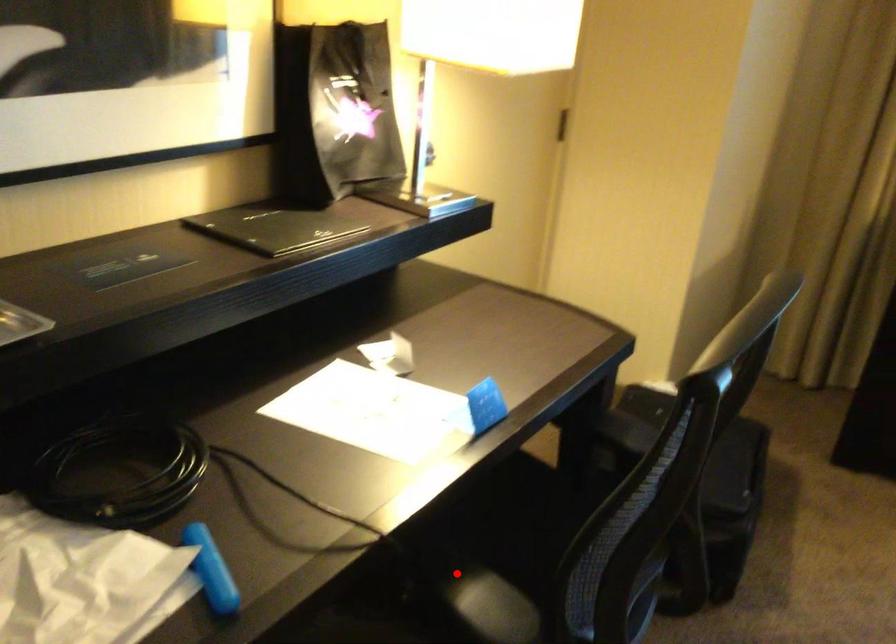
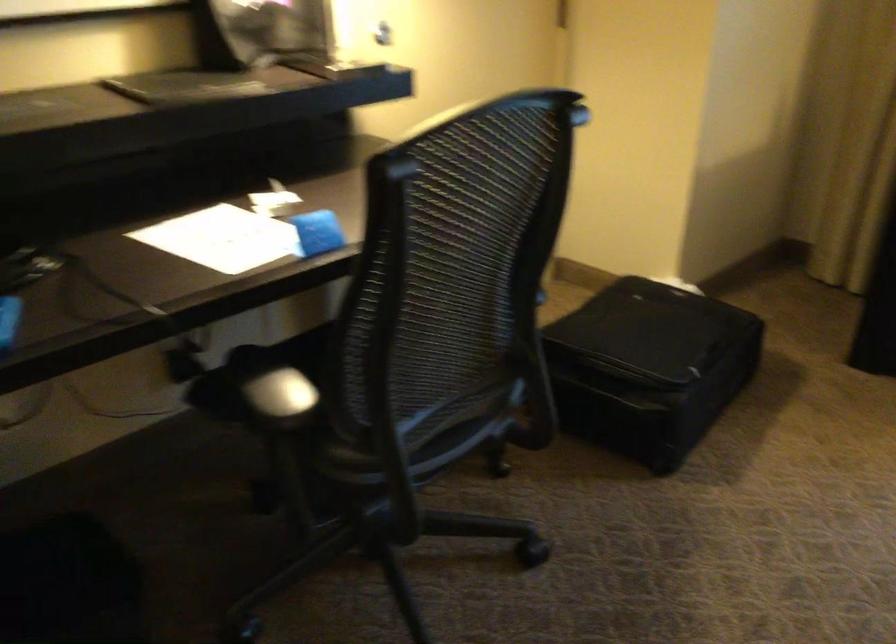
Question: I am providing you with two images of the same scene from different viewpoints. In image1, a red point is highlighted. Considering the same 3D point in image2, which of the following is correct?

Choices:
 (A) It is closer
 (B) It is farther

Answer: (B)